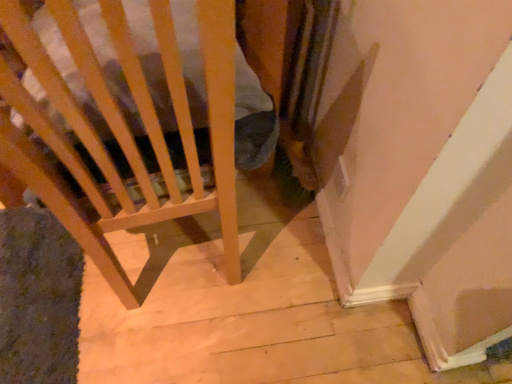
At what (x,y) coordinates should I click in order to perform the action: click on vacant area in front of light brown wooden chair at center. Please return your answer as a coordinate pair (x, y). This screenshot has height=384, width=512. Looking at the image, I should click on (147, 346).